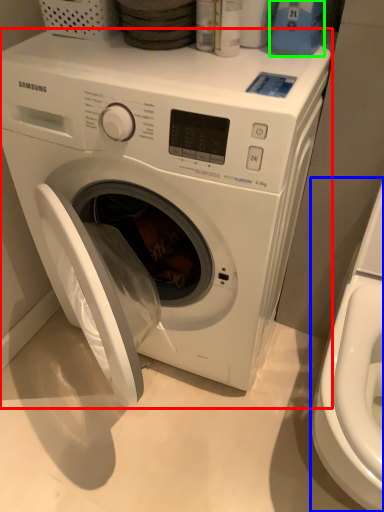
Question: Considering the real-world distances, which object is farthest from washing machine (highlighted by a red box)? washer (highlighted by a blue box) or cleaning product (highlighted by a green box)?

Choices:
 (A) washer
 (B) cleaning product

Answer: (B)